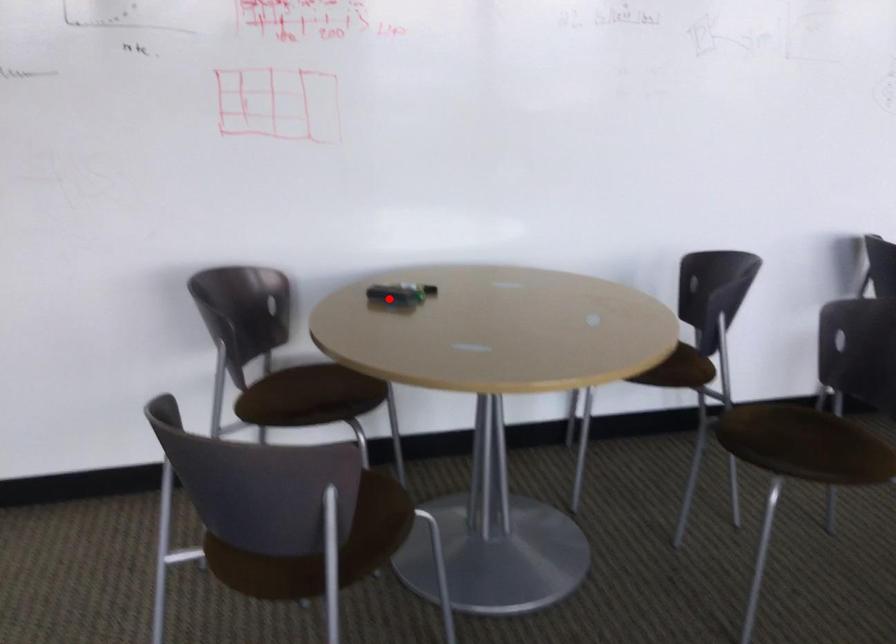
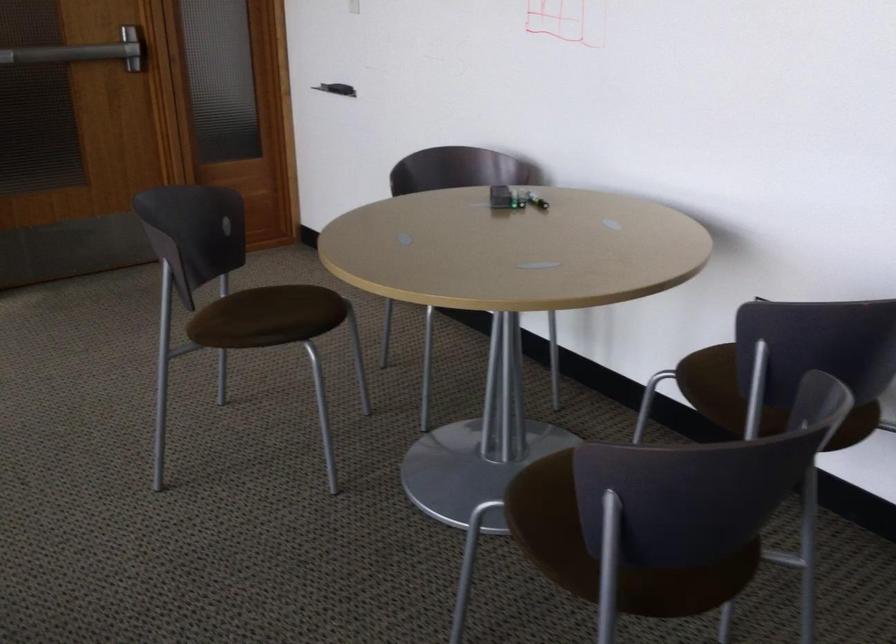
Locate, in the second image, the point that corresponds to the highlighted location in the first image.

(498, 198)